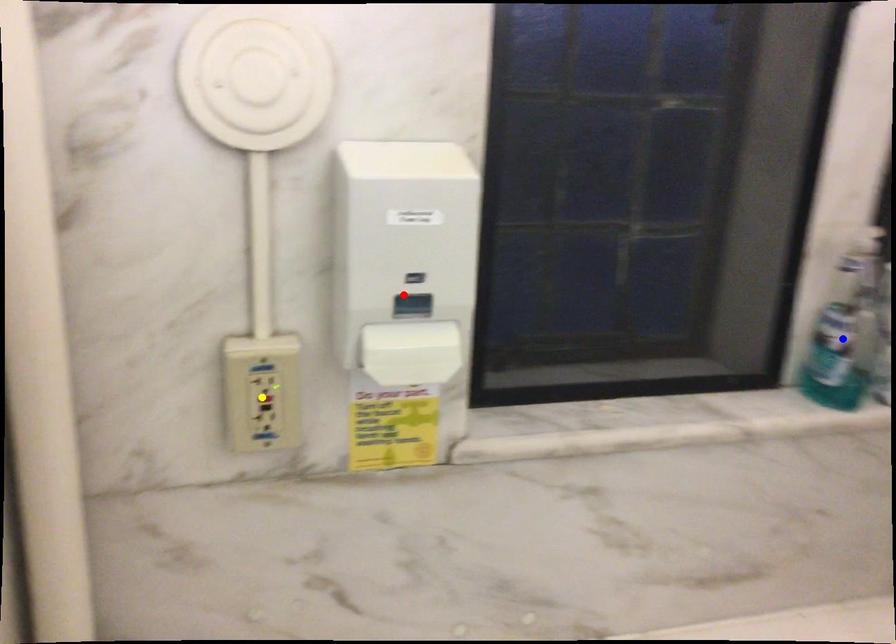
Order these from farthest to nearest:
- blue point
- red point
- yellow point

1. blue point
2. yellow point
3. red point